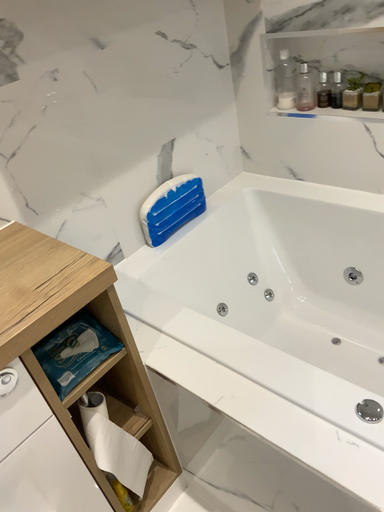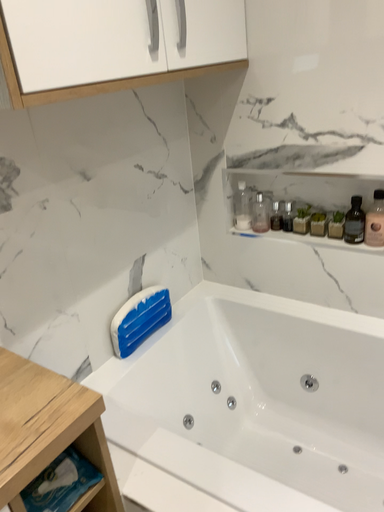
Question: Which way did the camera rotate in the video?

Choices:
 (A) rotated upward
 (B) rotated downward

Answer: (A)